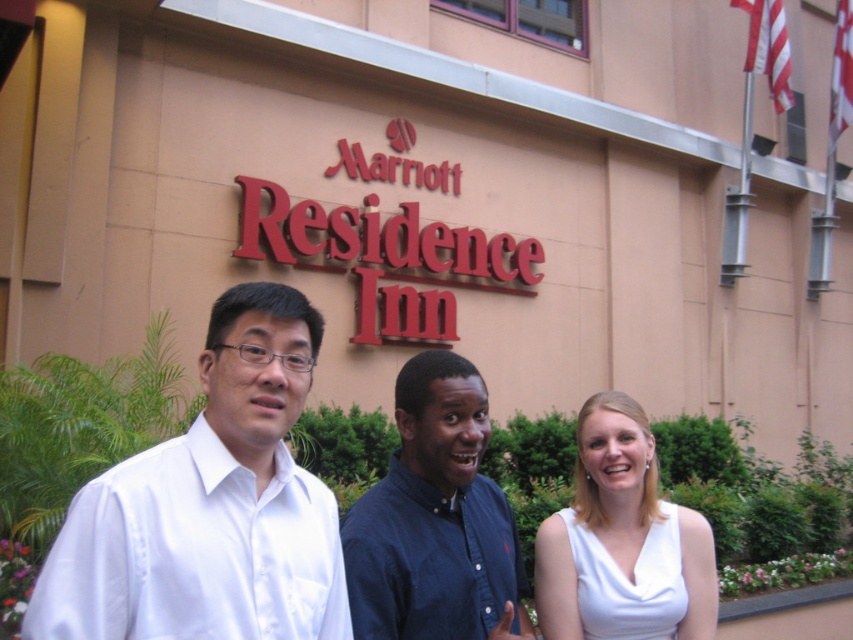
In the scene described, where is the white satin shirt at center located in terms of coordinates?

The white satin shirt at center is located at coordinates point [210,506].

You are a photographer taking a picture of the three people in front of the Marriott Residence Inn. You notice two white items at the center of the image. Which one is more in front between the white satin shirt at center and the white matte dress at center?

The white satin shirt at center is closer to the viewer than the white matte dress at center, so the white satin shirt at center is more in front.